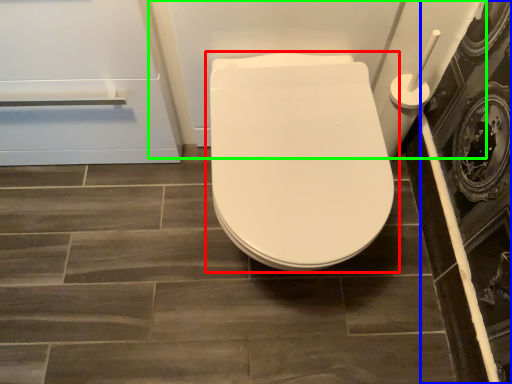
Question: Based on their relative distances, which object is farther from toilet (highlighted by a red box)? Choose from screen door (highlighted by a blue box) and bath (highlighted by a green box).

Choices:
 (A) screen door
 (B) bath

Answer: (A)